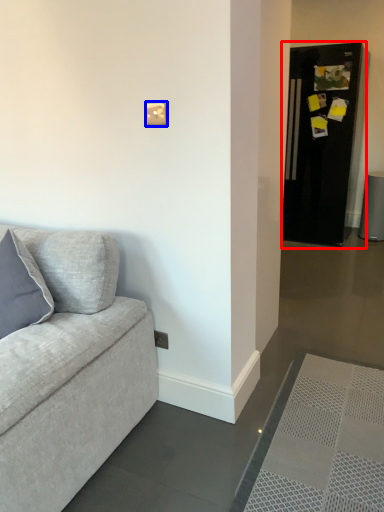
Question: Which point is further to the camera, fridge (highlighted by a red box) or light switch (highlighted by a blue box)?

Choices:
 (A) fridge
 (B) light switch

Answer: (A)